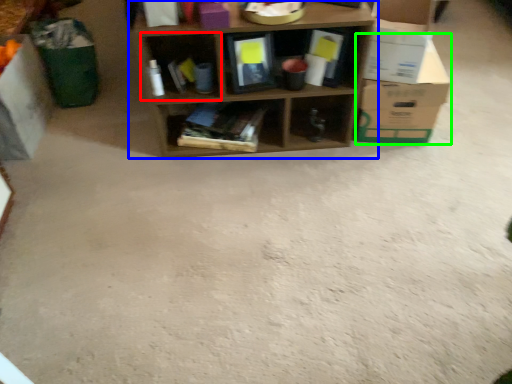
Question: Considering the real-world distances, which object is closest to shelf (highlighted by a red box)? shelf (highlighted by a blue box) or cardboard box (highlighted by a green box).

Choices:
 (A) shelf
 (B) cardboard box

Answer: (A)